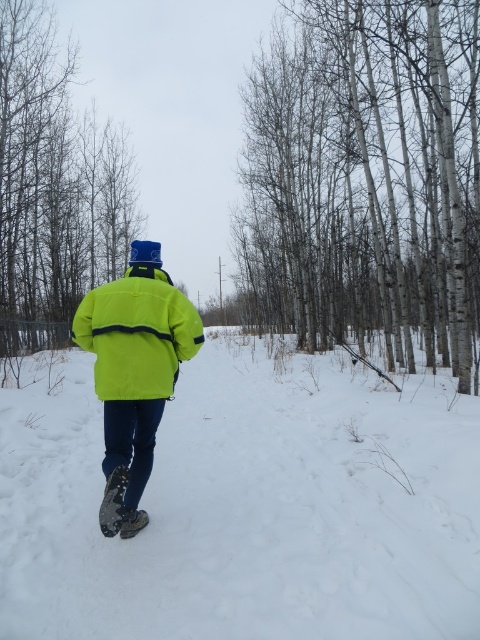
You are standing in a snowy forest and see a person wearing a neon yellow jacket at center and a smooth gray tree trunk at center. Which object is closer to you, the observer?

The smooth gray tree trunk at center is positioned over the neon yellow jacket at center, meaning it is closer to the observer.

You are a photographer trying to capture the bright yellow jacket at center and the smooth gray tree trunk at center in the same frame. Based on their positions, which object should you adjust your camera to focus on first to ensure both are in the frame?

The smooth gray tree trunk at center is positioned on the left side of bright yellow jacket at center. To capture both in the same frame, focus on the bright yellow jacket at center first, as it is closer to the center of the image, allowing the tree trunk to be included on its left side.

You are a photographer trying to capture the neon yellow jacket at center in your shot. The smooth gray tree trunk at center is blocking part of the jacket. Can you estimate whether the tree trunk is wider than the jacket?

The smooth gray tree trunk at center is wider than the neon yellow jacket at center, so the tree trunk may be blocking more of the jacket due to its greater width.